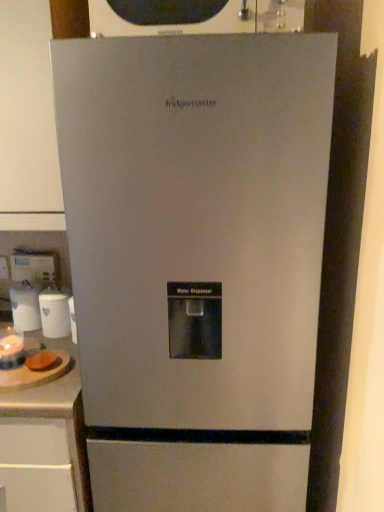
This screenshot has width=384, height=512. What do you see at coordinates (25, 307) in the screenshot? I see `white glossy water dispenser at center, acting as the 1th appliance starting from the back` at bounding box center [25, 307].

At what (x,y) coordinates should I click in order to perform the action: click on white glossy water dispenser at center, which is the 3th appliance in front-to-back order. Please return your answer as a coordinate pair (x, y). Looking at the image, I should click on (25, 307).

Identify the location of matte glass candle at lower left, which is the 1th appliance from front to back. Image resolution: width=384 pixels, height=512 pixels. (11, 348).

In order to click on brown bread at left in this screenshot , I will do `click(42, 361)`.

In the image, is white glossy canister at left, acting as the second appliance starting from the back, on the left side or the right side of satin silver refrigerator at center?

white glossy canister at left, acting as the second appliance starting from the back, is positioned on satin silver refrigerator at center's left side.

Is white glossy canister at left, marked as the 2th appliance in a front-to-back arrangement, bigger or smaller than satin silver refrigerator at center?

In the image, white glossy canister at left, marked as the 2th appliance in a front-to-back arrangement, appears to be smaller than satin silver refrigerator at center.

Is white glossy canister at left, marked as the 2th appliance in a front-to-back arrangement, positioned with its back to satin silver refrigerator at center?

No, white glossy canister at left, marked as the 2th appliance in a front-to-back arrangement,'s orientation is not away from satin silver refrigerator at center.

Which of these two, white glossy canister at left, marked as the 2th appliance in a front-to-back arrangement, or satin silver refrigerator at center, stands shorter?

With less height is white glossy canister at left, marked as the 2th appliance in a front-to-back arrangement.

Considering the sizes of satin silver refrigerator at center and brown bread at left in the image, is satin silver refrigerator at center taller or shorter than brown bread at left?

In the image, satin silver refrigerator at center appears to be taller than brown bread at left.

Considering the sizes of objects satin silver refrigerator at center and brown bread at left in the image provided, who is wider, satin silver refrigerator at center or brown bread at left?

With larger width is satin silver refrigerator at center.

The height and width of the screenshot is (512, 384). In order to click on food on the left side of satin silver refrigerator at center in this screenshot , I will do `click(42, 361)`.

Which point is more forward, (x=178, y=256) or (x=36, y=356)?

Positioned in front is point (x=178, y=256).

How many degrees apart are the facing directions of matte glass candle at lower left, which appears as the third appliance when viewed from the back, and satin silver refrigerator at center?

44.6 degrees.

Considering the positions of objects matte glass candle at lower left, which is the 1th appliance from front to back, and satin silver refrigerator at center in the image provided, who is behind, matte glass candle at lower left, which is the 1th appliance from front to back, or satin silver refrigerator at center?

matte glass candle at lower left, which is the 1th appliance from front to back, is further from the camera.

Identify the location of the 1st appliance above the satin silver refrigerator at center (from the image's perspective). This screenshot has height=512, width=384. (11, 348).

Is matte glass candle at lower left, which is the 1th appliance from front to back, to the left of satin silver refrigerator at center from the viewer's perspective?

Yes.

Based on the photo, in the image, is wooden cutting board at lower left positioned in front of or behind white glossy canister at left, marked as the 2th appliance in a front-to-back arrangement?

wooden cutting board at lower left is positioned closer to the viewer than white glossy canister at left, marked as the 2th appliance in a front-to-back arrangement.

Does wooden cutting board at lower left turn towards white glossy canister at left, acting as the second appliance starting from the back?

No, wooden cutting board at lower left does not turn towards white glossy canister at left, acting as the second appliance starting from the back.

Does point (70, 408) lie in front of point (66, 320)?

Yes, it is.

Considering the positions of objects wooden cutting board at lower left and white glossy canister at left, acting as the second appliance starting from the back, in the image provided, who is more to the left, wooden cutting board at lower left or white glossy canister at left, acting as the second appliance starting from the back,?

From the viewer's perspective, wooden cutting board at lower left appears more on the left side.

Identify the location of appliance that is on the left side of matte glass candle at lower left, which is the 1th appliance from front to back. (25, 307).

From the image's perspective, which one is positioned lower, matte glass candle at lower left, which is the 1th appliance from front to back, or white glossy water dispenser at center, acting as the 1th appliance starting from the back?

matte glass candle at lower left, which is the 1th appliance from front to back, is shown below in the image.

Considering the sizes of objects matte glass candle at lower left, which appears as the third appliance when viewed from the back, and white glossy water dispenser at center, which is the 3th appliance in front-to-back order, in the image provided, who is thinner, matte glass candle at lower left, which appears as the third appliance when viewed from the back, or white glossy water dispenser at center, which is the 3th appliance in front-to-back order,?

Thinner between the two is matte glass candle at lower left, which appears as the third appliance when viewed from the back.

Where is `food below the white glossy canister at left, acting as the second appliance starting from the back (from a real-world perspective)`? The height and width of the screenshot is (512, 384). food below the white glossy canister at left, acting as the second appliance starting from the back (from a real-world perspective) is located at coordinates (42, 361).

Is white glossy canister at left, marked as the 2th appliance in a front-to-back arrangement, oriented towards brown bread at left?

Yes.

Looking at this image, based on their sizes in the image, would you say white glossy canister at left, marked as the 2th appliance in a front-to-back arrangement, is bigger or smaller than brown bread at left?

Considering their sizes, white glossy canister at left, marked as the 2th appliance in a front-to-back arrangement, takes up more space than brown bread at left.

From the image's perspective, which object appears higher, white glossy canister at left, acting as the second appliance starting from the back, or brown bread at left?

From the image's view, white glossy canister at left, acting as the second appliance starting from the back, is above.

Does white glossy water dispenser at center, acting as the 1th appliance starting from the back, lie in front of white glossy canister at left, acting as the second appliance starting from the back?

No, it is behind white glossy canister at left, acting as the second appliance starting from the back.

Is white glossy water dispenser at center, acting as the 1th appliance starting from the back, not near white glossy canister at left, marked as the 2th appliance in a front-to-back arrangement?

No, there isn't a large distance between white glossy water dispenser at center, acting as the 1th appliance starting from the back, and white glossy canister at left, marked as the 2th appliance in a front-to-back arrangement.

Is white glossy water dispenser at center, acting as the 1th appliance starting from the back, to the left or to the right of white glossy canister at left, acting as the second appliance starting from the back, in the image?

Based on their positions, white glossy water dispenser at center, acting as the 1th appliance starting from the back, is located to the left of white glossy canister at left, acting as the second appliance starting from the back.

Is white glossy canister at left, marked as the 2th appliance in a front-to-back arrangement, at the back of white glossy water dispenser at center, acting as the 1th appliance starting from the back?

No, white glossy water dispenser at center, acting as the 1th appliance starting from the back, is not facing away from white glossy canister at left, marked as the 2th appliance in a front-to-back arrangement.

Where is `refrigerator below the white glossy canister at left, acting as the second appliance starting from the back (from the image's perspective)`? This screenshot has width=384, height=512. refrigerator below the white glossy canister at left, acting as the second appliance starting from the back (from the image's perspective) is located at coordinates (196, 261).

Locate an element on the screen. food above the satin silver refrigerator at center (from a real-world perspective) is located at coordinates (42, 361).

Looking at the image, which one is located closer to wooden cutting board at lower left, white glossy canister at left, acting as the second appliance starting from the back, or matte glass candle at lower left, which is the 1th appliance from front to back?

matte glass candle at lower left, which is the 1th appliance from front to back.

When comparing their distances from brown bread at left, does white glossy canister at left, marked as the 2th appliance in a front-to-back arrangement, or wooden cutting board at lower left seem further?

white glossy canister at left, marked as the 2th appliance in a front-to-back arrangement, is positioned further to the anchor brown bread at left.

Estimate the real-world distances between objects in this image. Which object is closer to matte glass candle at lower left, which is the 1th appliance from front to back, wooden cutting board at lower left or satin silver refrigerator at center?

wooden cutting board at lower left.

Based on their spatial positions, is satin silver refrigerator at center or brown bread at left closer to white glossy water dispenser at center, which is the 3th appliance in front-to-back order?

brown bread at left lies closer to white glossy water dispenser at center, which is the 3th appliance in front-to-back order, than the other object.

Based on their spatial positions, is brown bread at left or satin silver refrigerator at center closer to wooden cutting board at lower left?

brown bread at left.

From the picture: Considering their positions, is white glossy water dispenser at center, which is the 3th appliance in front-to-back order, positioned further to brown bread at left than wooden cutting board at lower left?

The object further to brown bread at left is white glossy water dispenser at center, which is the 3th appliance in front-to-back order.

Based on their spatial positions, is white glossy water dispenser at center, which is the 3th appliance in front-to-back order, or satin silver refrigerator at center closer to white glossy canister at left, acting as the second appliance starting from the back?

Among the two, white glossy water dispenser at center, which is the 3th appliance in front-to-back order, is located nearer to white glossy canister at left, acting as the second appliance starting from the back.

Which object lies further to the anchor point white glossy canister at left, marked as the 2th appliance in a front-to-back arrangement, wooden cutting board at lower left or white glossy water dispenser at center, acting as the 1th appliance starting from the back?

wooden cutting board at lower left is positioned further to the anchor white glossy canister at left, marked as the 2th appliance in a front-to-back arrangement.

This screenshot has height=512, width=384. Identify the location of food between wooden cutting board at lower left and satin silver refrigerator at center. (42, 361).

At what (x,y) coordinates should I click in order to perform the action: click on food located between satin silver refrigerator at center and white glossy canister at left, acting as the second appliance starting from the back, in the depth direction. Please return your answer as a coordinate pair (x, y). Looking at the image, I should click on (42, 361).

Identify the location of food positioned between wooden cutting board at lower left and white glossy water dispenser at center, which is the 3th appliance in front-to-back order, from near to far. (42, 361).

The image size is (384, 512). I want to click on counter top between satin silver refrigerator at center and white glossy water dispenser at center, acting as the 1th appliance starting from the back, from front to back, so click(46, 386).